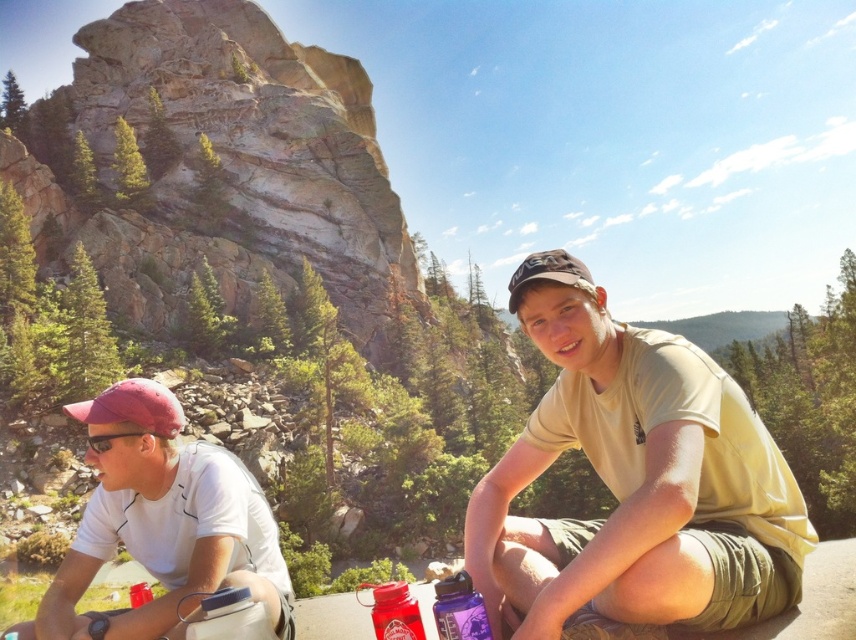
Between rustic stone mountain at upper left and tan cotton shirt at center, which one has more height?

rustic stone mountain at upper left

What are the coordinates of `rustic stone mountain at upper left` in the screenshot? It's located at (223, 166).

Does tan cotton shirt at center have a larger size compared to white matte shirt at left?

Correct, tan cotton shirt at center is larger in size than white matte shirt at left.

Which is below, tan cotton shirt at center or white matte shirt at left?

Positioned lower is white matte shirt at left.

Find the location of a particular element. The width and height of the screenshot is (856, 640). tan cotton shirt at center is located at coordinates (634, 480).

Does purple matte water bottle at lower center appear on the right side of shiny red plastic bottle at lower center?

Correct, you'll find purple matte water bottle at lower center to the right of shiny red plastic bottle at lower center.

Does point (455, 608) come closer to viewer compared to point (397, 621)?

Yes.

Is point (456, 572) positioned behind point (391, 609)?

Yes, point (456, 572) is farther from viewer.

The image size is (856, 640). I want to click on purple matte water bottle at lower center, so click(459, 609).